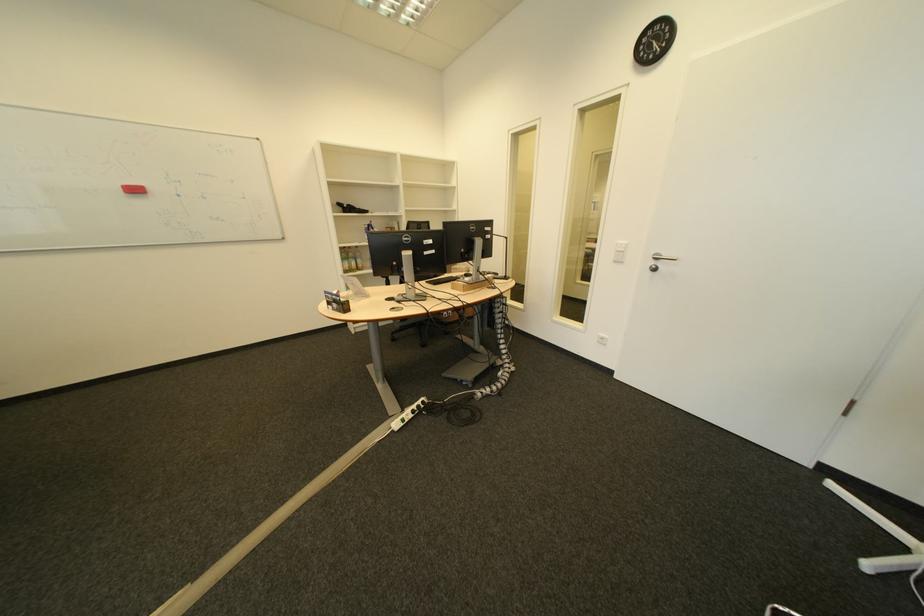
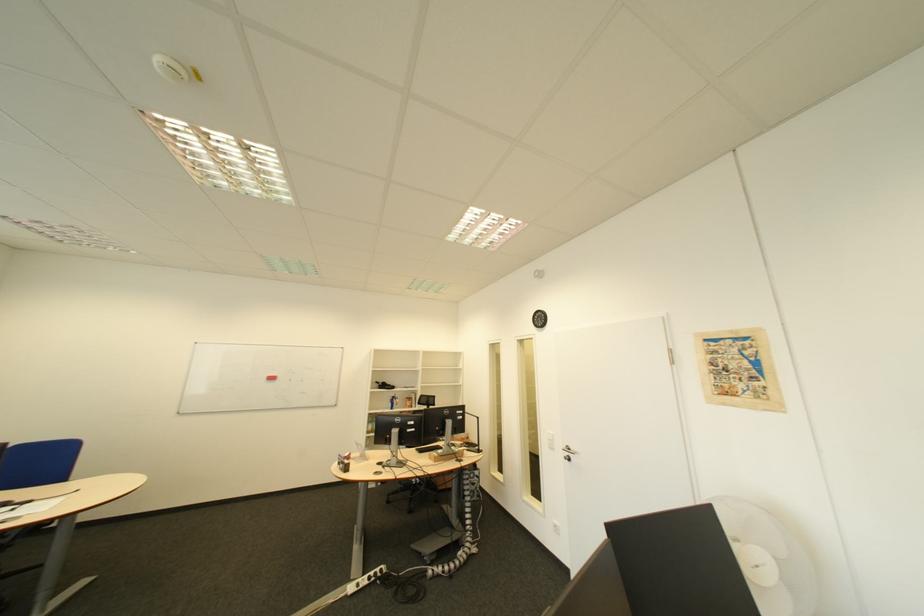
In the second image, find the point that corresponds to point 149,191 in the first image.

(285, 379)